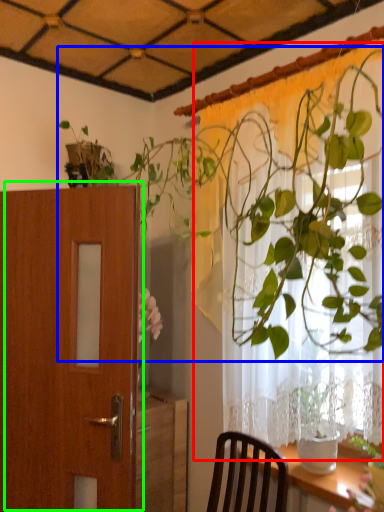
Question: Estimate the real-world distances between objects in this image. Which object is farther from curtain (highlighted by a red box), houseplant (highlighted by a blue box) or door (highlighted by a green box)?

Choices:
 (A) houseplant
 (B) door

Answer: (B)